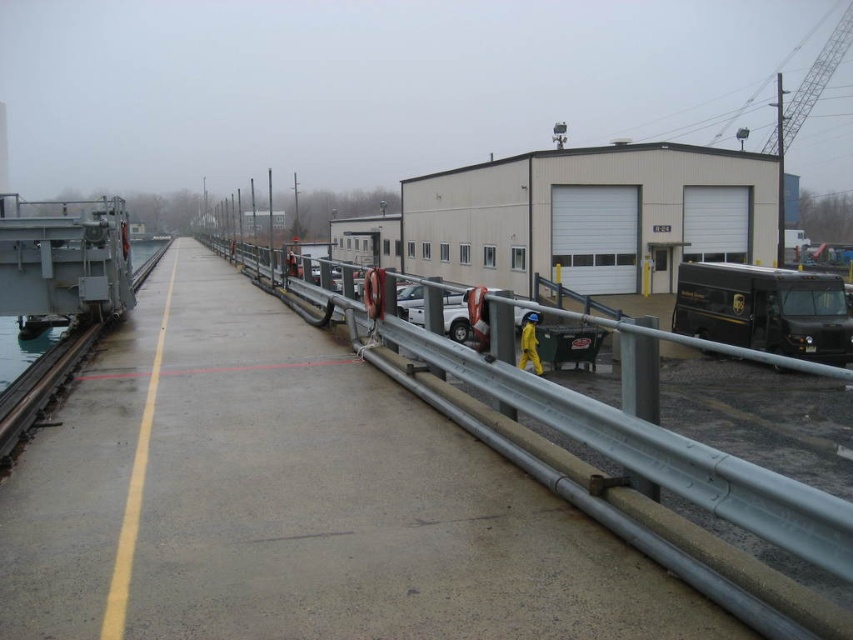
In the scene shown: You are a delivery driver who needs to park your truck on the metal at center. However, there is a gray metallic train track at left nearby. Considering their heights, which object might pose a challenge for parking your truck and why?

The gray metallic train track at left is taller than the metal at center, so parking the truck on the metal at center might be problematic due to the height difference between the two objects.

You are a delivery driver who needs to cross the metal at center and gray metallic train track at left. Which one is above the other?

The metal at center is positioned over the gray metallic train track at left, so the metal at center is above the gray metallic train track at left.